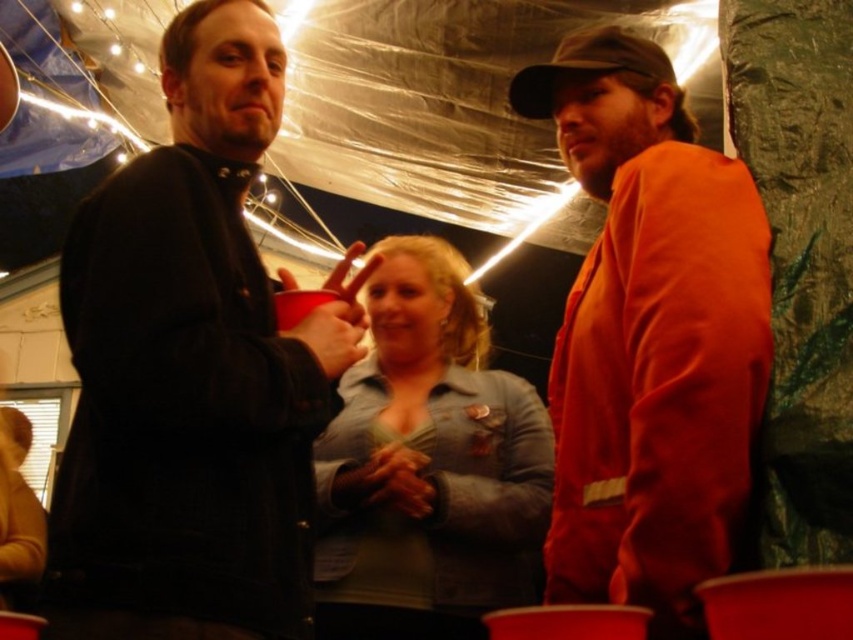
Looking at this image, which of these two, orange cotton shirt at right or denim jacket at center, stands taller?

Standing taller between the two is orange cotton shirt at right.

Is the position of orange cotton shirt at right less distant than that of denim jacket at center?

Yes.

What do you see at coordinates (650, 337) in the screenshot? I see `orange cotton shirt at right` at bounding box center [650, 337].

The width and height of the screenshot is (853, 640). In order to click on orange cotton shirt at right in this screenshot , I will do pyautogui.click(x=650, y=337).

Based on the photo, which of these two, matte black jacket at left or denim jacket at center, stands taller?

matte black jacket at left is taller.

Does matte black jacket at left come in front of denim jacket at center?

Yes, matte black jacket at left is in front of denim jacket at center.

Find the location of `matte black jacket at left`. matte black jacket at left is located at coordinates (190, 371).

The image size is (853, 640). Find the location of `matte black jacket at left`. matte black jacket at left is located at coordinates (190, 371).

Who is positioned more to the right, matte black jacket at left or orange cotton shirt at right?

From the viewer's perspective, orange cotton shirt at right appears more on the right side.

Does matte black jacket at left appear on the left side of orange cotton shirt at right?

Indeed, matte black jacket at left is positioned on the left side of orange cotton shirt at right.

Is point (265, 609) positioned behind point (729, 352)?

Yes, point (265, 609) is farther from viewer.

Where is `matte black jacket at left`? matte black jacket at left is located at coordinates click(190, 371).